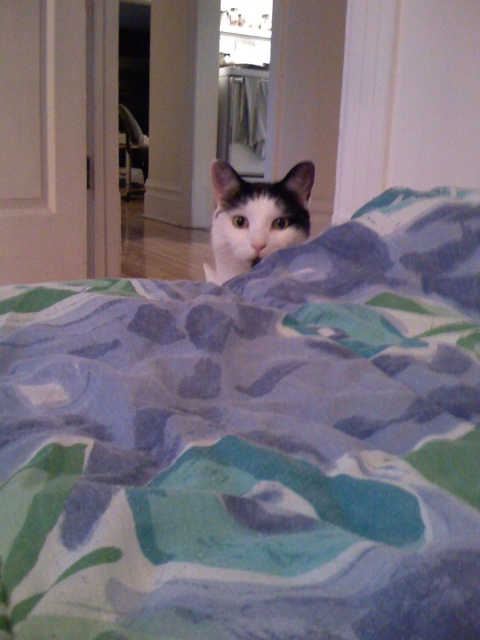
You are trying to determine if the printed fabric blanket at center can fully cover the white fur cat at center. Based on their sizes, can the blanket cover the cat completely?

The printed fabric blanket at center is wider than the white fur cat at center, so it can fully cover the cat.

You want to place a small toy under the printed fabric blanket at center so that the white fur cat at center can find it easily. Where should you place the toy relative to the blanket?

The printed fabric blanket at center has a larger size compared to white fur cat at center, so placing the toy near the edge of the blanket would allow the cat to find it easily without being completely hidden.